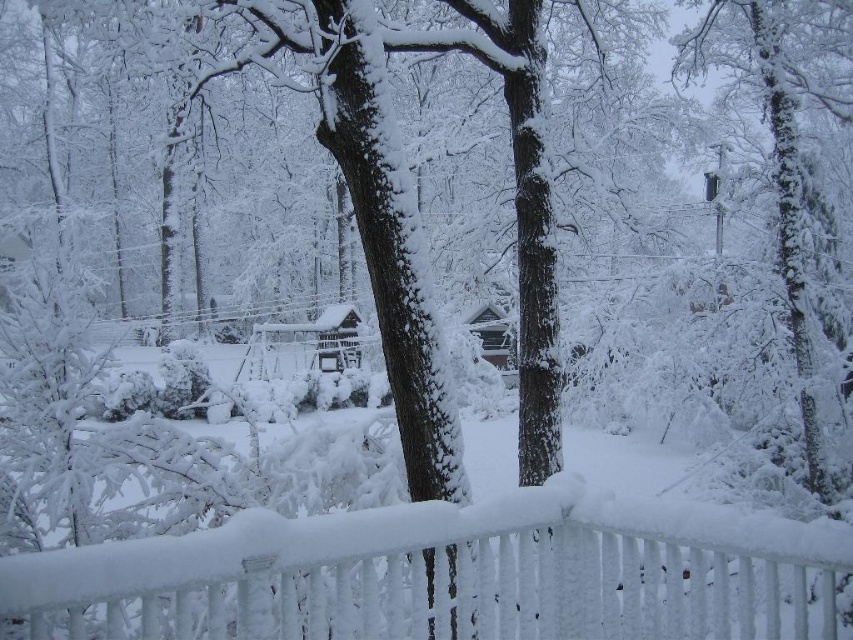
Question: Which of the following is the farthest from the observer?

Choices:
 (A) (805, 300)
 (B) (9, 598)

Answer: (A)

Question: From the image, what is the correct spatial relationship of white frosted fence at lower center in relation to snow-covered tree at upper right?

Choices:
 (A) right
 (B) left

Answer: (B)

Question: Does white frosted fence at lower center appear over snow-covered tree at upper right?

Choices:
 (A) yes
 (B) no

Answer: (A)

Question: Is white frosted fence at lower center above snow-covered tree at upper right?

Choices:
 (A) yes
 (B) no

Answer: (A)